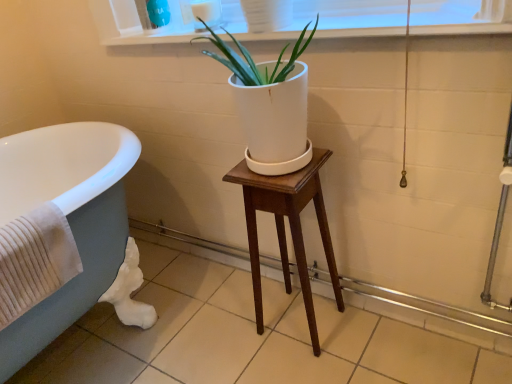
At what (x,y) coordinates should I click in order to perform the action: click on empty space that is ontop of white glossy window sill at upper center (from a real-world perspective). Please return your answer as a coordinate pair (x, y). This screenshot has height=384, width=512. Looking at the image, I should click on point(329,26).